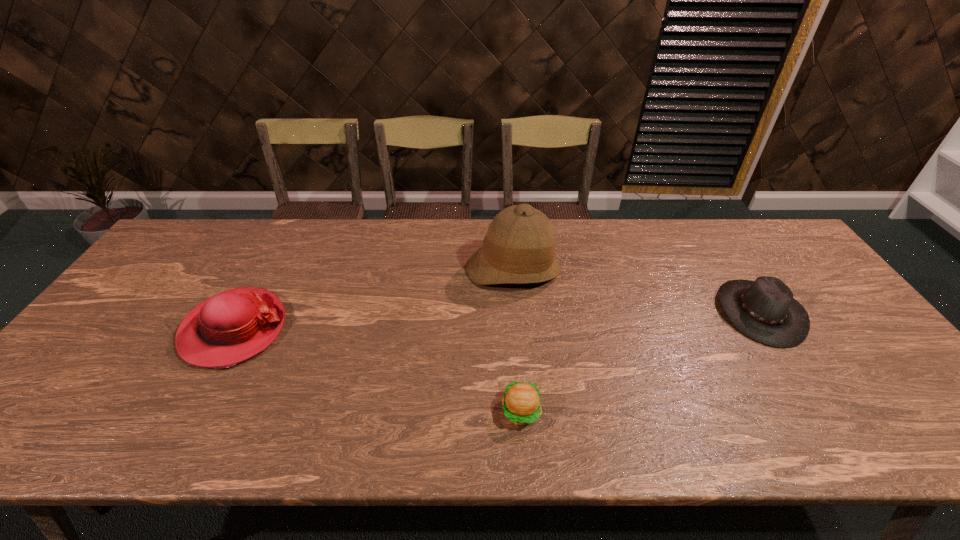
Locate an element on the screen. This screenshot has width=960, height=540. unoccupied area between the tallest hat and the third tallest object is located at coordinates (636, 291).

Where is `object that stands as the closest to the leftmost object`? This screenshot has width=960, height=540. object that stands as the closest to the leftmost object is located at coordinates (519, 248).

This screenshot has width=960, height=540. What are the coordinates of `object that ranks as the closest to the shortest object` in the screenshot? It's located at (519, 248).

Identify the location of the closest hat relative to the third tallest object. (519, 248).

The width and height of the screenshot is (960, 540). In order to click on hat that stands as the closest to the second hat from left to right in this screenshot , I will do `click(764, 310)`.

Locate an element on the screen. vacant space that satisfies the following two spatial constraints: 1. on the front-facing side of the second hat from right to left; 2. at the front of the third shortest object with a bow is located at coordinates pos(519,329).

Where is `free spot that satisfies the following two spatial constraints: 1. at the front of the leftmost hat with a bow; 2. on the right side of the hamburger`? free spot that satisfies the following two spatial constraints: 1. at the front of the leftmost hat with a bow; 2. on the right side of the hamburger is located at coordinates (189, 411).

I want to click on vacant area in the image that satisfies the following two spatial constraints: 1. on the back side of the hamburger; 2. at the front of the third shortest object with a bow, so click(x=515, y=329).